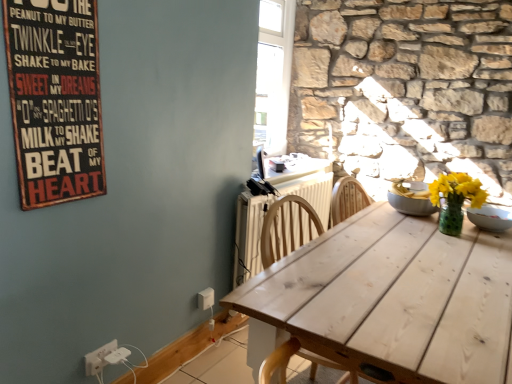
Question: In terms of width, does white painted radiator at center look wider or thinner when compared to white wood table at center?

Choices:
 (A) thin
 (B) wide

Answer: (A)

Question: Considering the positions of white painted radiator at center and white wood table at center in the image, is white painted radiator at center taller or shorter than white wood table at center?

Choices:
 (A) short
 (B) tall

Answer: (A)

Question: Based on their relative distances, which object is farther from the white plastic electric outlet at lower left, the 2th electric outlet in the back-to-front sequence?

Choices:
 (A) white painted radiator at center
 (B) white plastic electric outlet at lower center, which appears as the 1th electric outlet when viewed from the right
 (C) white wood table at center
 (D) wooden signboard at upper left
 (E) white glossy bowl at upper right

Answer: (E)

Question: Which object is the farthest from the wooden signboard at upper left?

Choices:
 (A) white plastic electric outlet at lower left, which is the 2th electric outlet in right-to-left order
 (B) white painted radiator at center
 (C) white glossy bowl at upper right
 (D) white wood table at center
 (E) white plastic electric outlet at lower center, which appears as the 1th electric outlet when viewed from the right

Answer: (C)